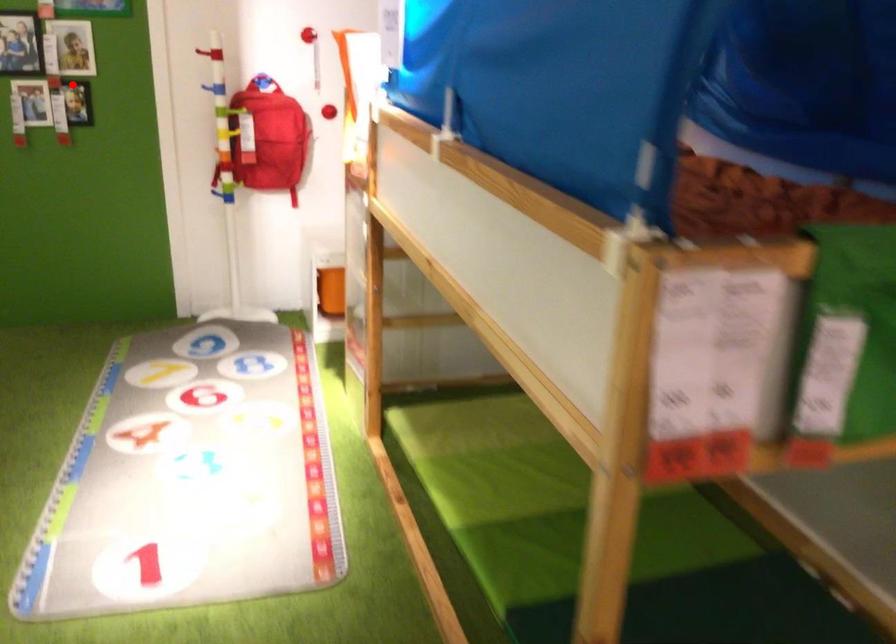
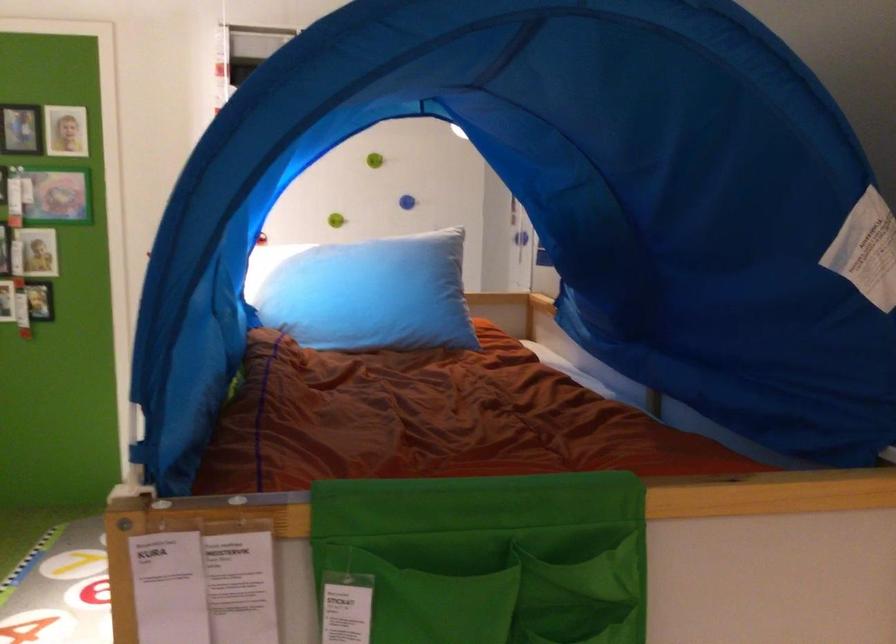
Question: I am providing you with two images of the same scene from different viewpoints. In image1, a red point is highlighted. Considering the same 3D point in image2, which of the following is correct?

Choices:
 (A) It is closer
 (B) It is farther

Answer: (B)